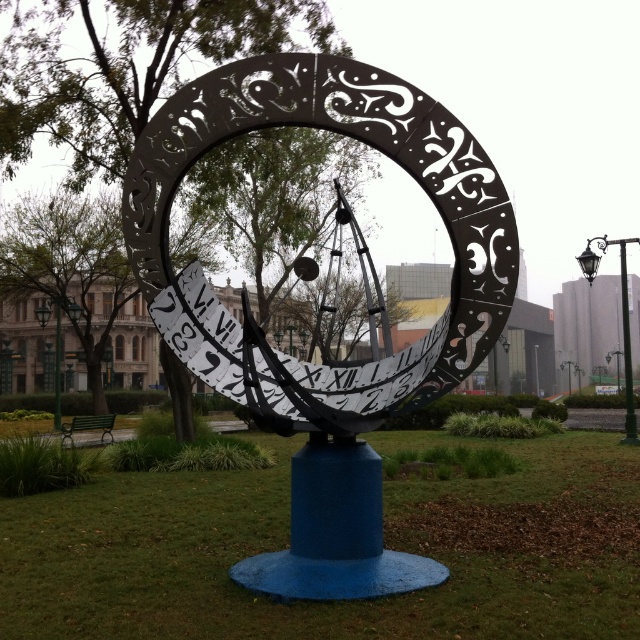
You are a maintenance worker needing to access the black metal pole at right for repairs. The black metal clock at center is blocking your path. From your current position in front of the sculpture, which direction should you move to bypass the obstruction?

Since the black metal clock at center is in front of the black metal pole at right, you should move to the side, either left or right, to go around the black metal clock at center and access the black metal pole at right.

You are a park visitor who wants to take a photo of the metallic blue sundial at center and the black metal pole at right. To ensure both are visible in your photo, which object should you position closer to the camera?

The metallic blue sundial at center is below the black metal pole at right, so you should position the black metal pole at right closer to the camera to ensure both are visible in the photo.

From the picture: You are standing in the park facing the sculpture. There are two points on the sculpture labeled as point (384, 122) and point (198, 369). Which point is closer to you?

Point (384, 122) is in front of point (198, 369), so it is closer to you.